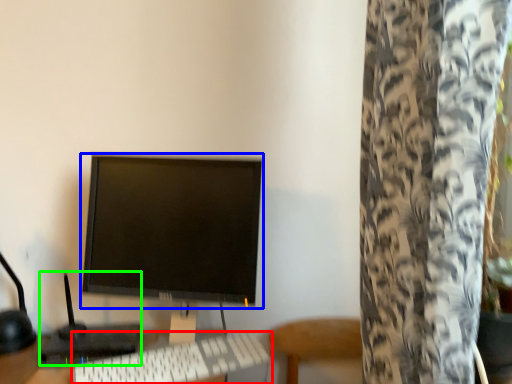
Question: Which object is positioned closest to computer keyboard (highlighted by a red box)? Select from computer monitor (highlighted by a blue box) and computer (highlighted by a green box).

Choices:
 (A) computer monitor
 (B) computer

Answer: (B)